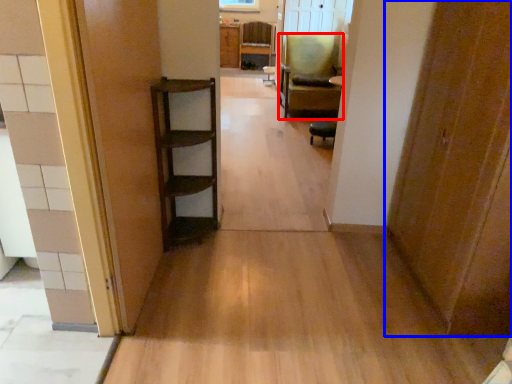
Question: Which object is further to the camera taking this photo, chair (highlighted by a red box) or door (highlighted by a blue box)?

Choices:
 (A) chair
 (B) door

Answer: (A)